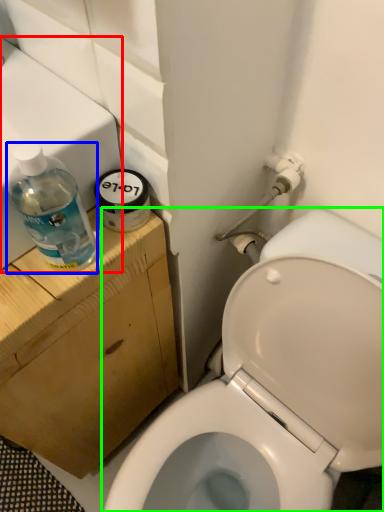
Question: Estimate the real-world distances between objects in this image. Which object is closer to sink (highlighted by a red box), bottle (highlighted by a blue box) or toilet (highlighted by a green box)?

Choices:
 (A) bottle
 (B) toilet

Answer: (A)